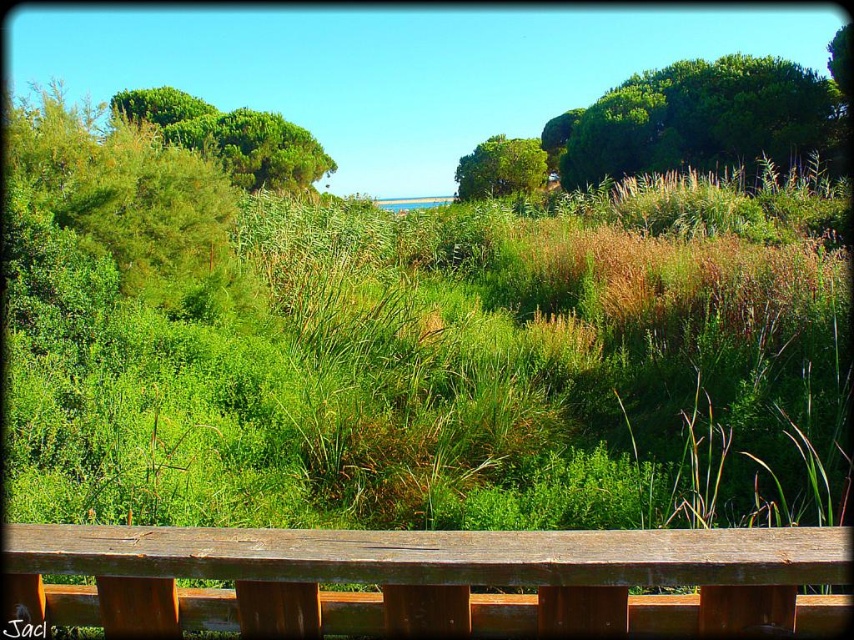
You are a hiker who wants to take a photo of the green leafy tree at upper right and the green leafy tree at center. Which tree should you stand closer to in order to capture both in the same frame?

To capture both the green leafy tree at upper right and the green leafy tree at center in the same frame, you should stand closer to the green leafy tree at center since it is shorter than the green leafy tree at upper right, allowing both to fit within the camera view.

You are standing at the center of the wooden railing in the foreground of the image. You want to walk towards the green leafy tree at upper right. In which direction should you move relative to the wooden railing?

You should move towards the upper right direction relative to the wooden railing to reach the green leafy tree at upper right.

You are standing at the starting point and see two points marked in the image. The first point is at coordinates point (188, 593) and the second is at point (798, 150). Which point is closer to you?

Point (188, 593) is in front of point (798, 150), so it is closer to you.